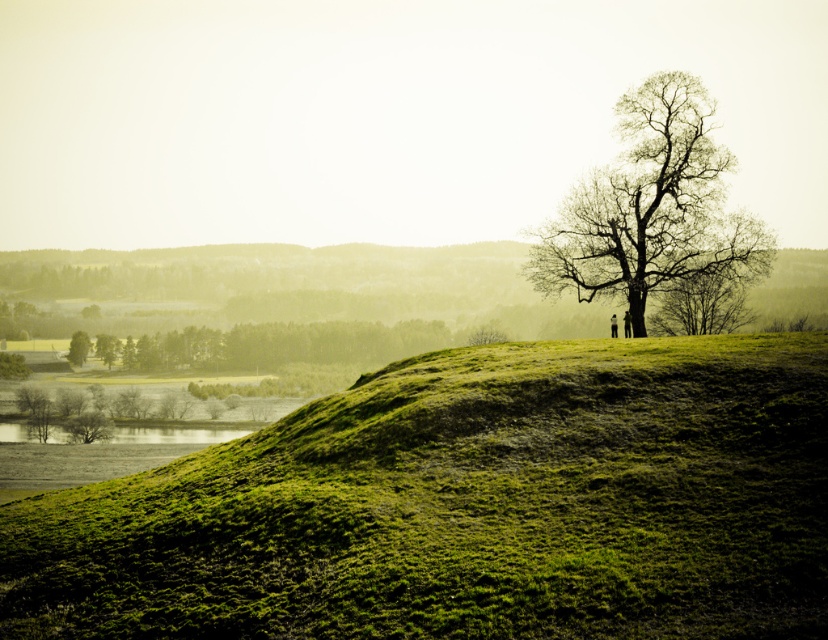
Question: Which object is farther from the camera taking this photo?

Choices:
 (A) green mossy hillside at lower left
 (B) green mossy hillside at lower center

Answer: (A)

Question: Does green mossy hillside at lower center appear under green mossy bush at lower left?

Choices:
 (A) no
 (B) yes

Answer: (A)

Question: Which point appears closest to the camera in this image?

Choices:
 (A) (80, 355)
 (B) (734, 272)
 (C) (326, 616)

Answer: (C)

Question: Estimate the real-world distances between objects in this image. Which object is farther from the green mossy hillside at lower left?

Choices:
 (A) bare branches at upper right
 (B) green mossy bush at lower left
 (C) green mossy hillside at upper center

Answer: (C)

Question: Does bare wood tree at upper right have a smaller size compared to green mossy hillside at lower center?

Choices:
 (A) no
 (B) yes

Answer: (A)

Question: Can you confirm if green mossy hillside at upper center is positioned below bare wood tree at upper right?

Choices:
 (A) yes
 (B) no

Answer: (A)